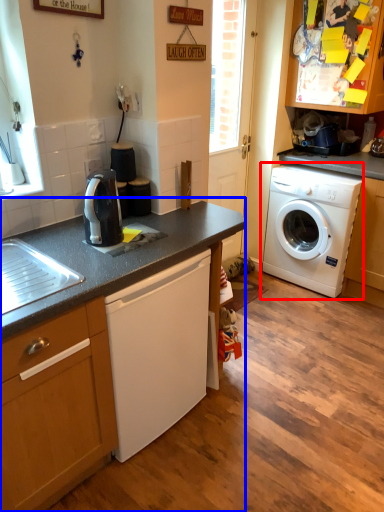
Question: Which of the following is the closest to the observer, washing machine (highlighted by a red box) or countertop (highlighted by a blue box)?

Choices:
 (A) washing machine
 (B) countertop

Answer: (B)